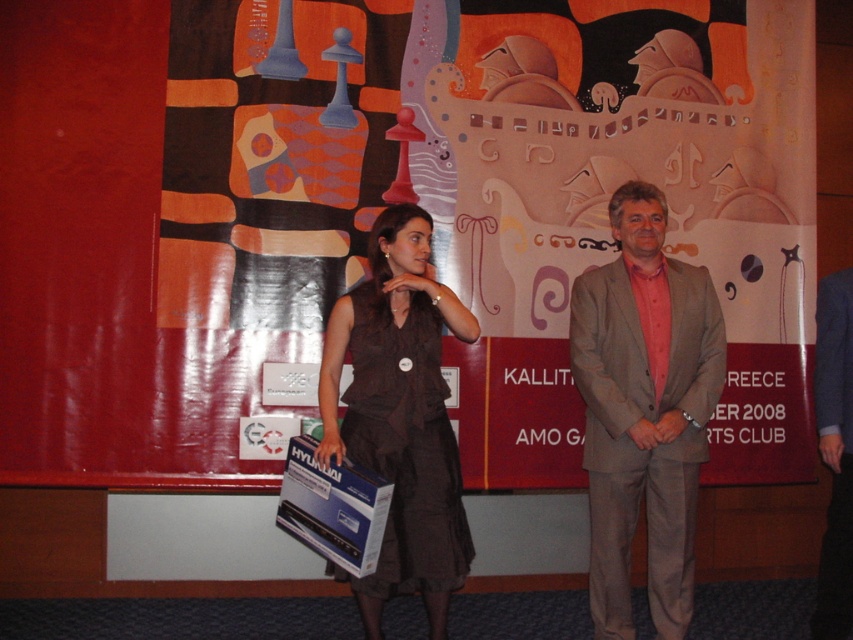
You are attending a conference and need to present a document to the organizers. The document must be handed over to the person wearing the gray fabric suit at center. However, there is a matte cardboard poster at center in your path. Can you reach the person without moving the poster?

The matte cardboard poster at center is above the gray fabric suit at center, so you can reach the person wearing the gray fabric suit at center without moving the poster since the poster is positioned above them.

Based on the photo, you are a photographer at the event. You need to adjust the lighting so that the person in the brown fabric dress at center is fully visible without the gray fabric suit at center blocking them. Is the current arrangement possible to achieve this?

The brown fabric dress at center is in front of the gray fabric suit at center, so adjusting the lighting will allow the person in the brown fabric dress at center to be fully visible without the gray fabric suit at center blocking them since the dress is already positioned in front.